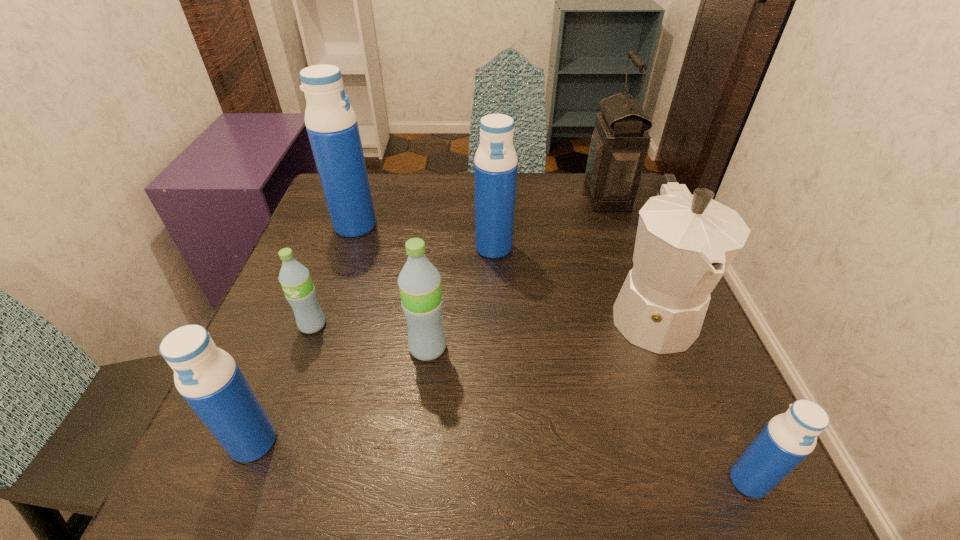
Locate an element on the screen. the rightmost blue water bottle is located at coordinates (788, 438).

The width and height of the screenshot is (960, 540). Identify the location of the rightmost water bottle. (788, 438).

Identify the location of free spot located 0.100m on the back of the tallest water bottle. This screenshot has height=540, width=960. coord(367,192).

You are a GUI agent. You are given a task and a screenshot of the screen. Output one action in this format:
    pyautogui.click(x=<x>, y=<y>)
    Task: Click on the blank area located 0.080m on the front-facing side of the farthest object
    This screenshot has height=540, width=960.
    Given the screenshot: What is the action you would take?
    pyautogui.click(x=554, y=197)

At what (x,y) coordinates should I click in order to perform the action: click on free space located on the front-facing side of the farthest object. Please return your answer as a coordinate pair (x, y). Looking at the image, I should click on (447, 197).

Image resolution: width=960 pixels, height=540 pixels. I want to click on free space located 0.350m on the front-facing side of the farthest object, so click(451, 197).

Identify the location of free space located 0.230m on the front of the second tallest water bottle. The image size is (960, 540). (497, 342).

Where is `free region located at the spout of the coffeepot`? Image resolution: width=960 pixels, height=540 pixels. free region located at the spout of the coffeepot is located at coordinates (713, 475).

In order to click on blank area located on the right of the fourth water bottle from left to right in this screenshot , I will do `click(491, 348)`.

Locate an element on the screen. This screenshot has width=960, height=540. vacant region located on the right of the third biggest blue water bottle is located at coordinates (375, 442).